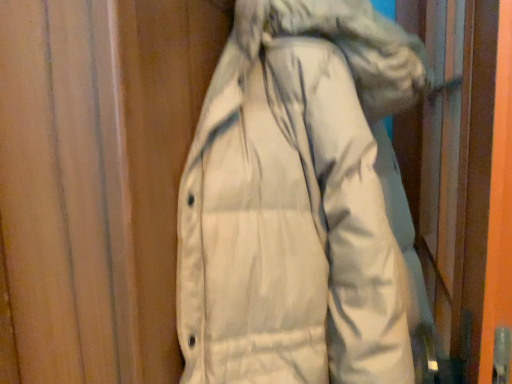
Question: Should I look upward or downward to see white matte jacket at center?

Choices:
 (A) up
 (B) down

Answer: (B)